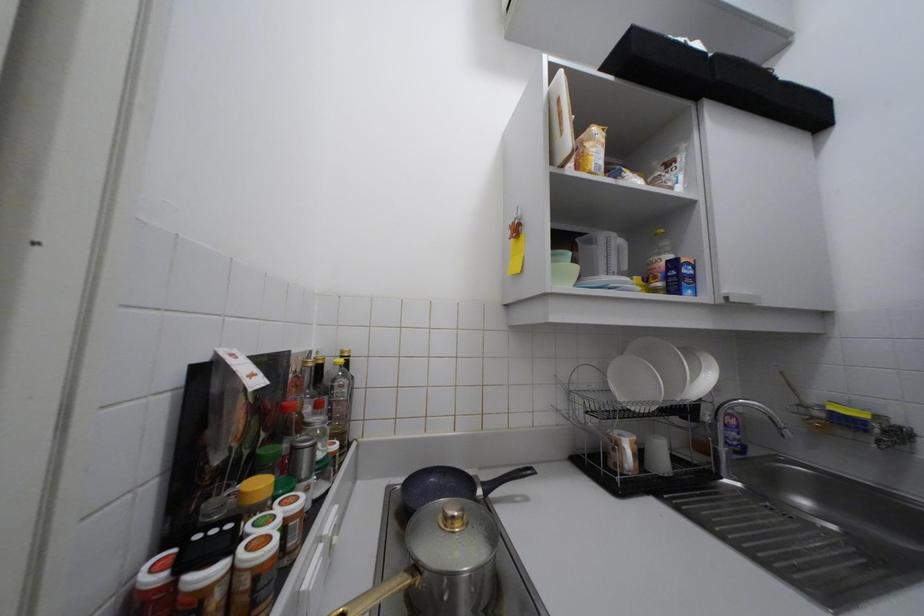
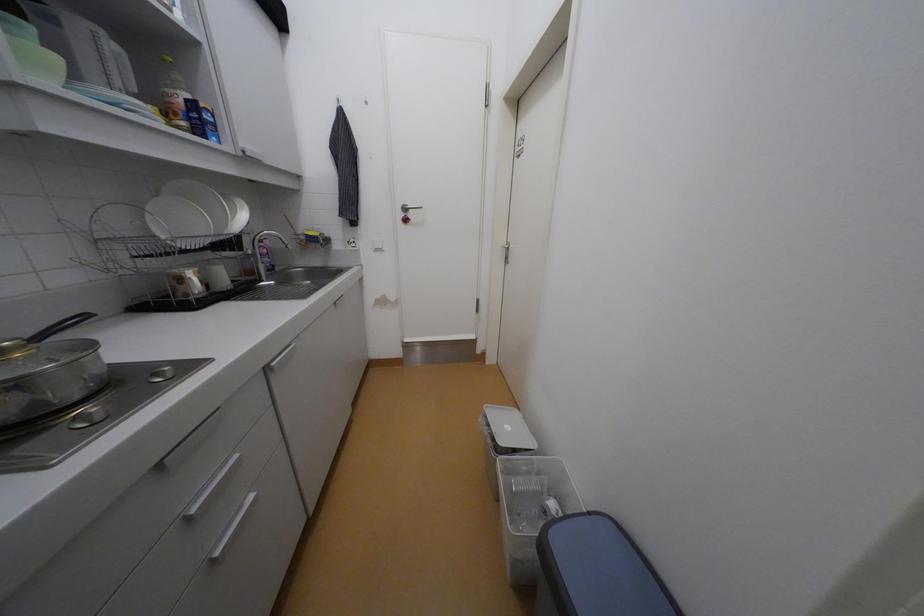
How did the camera likely rotate?

The camera's rotation is toward right-down.